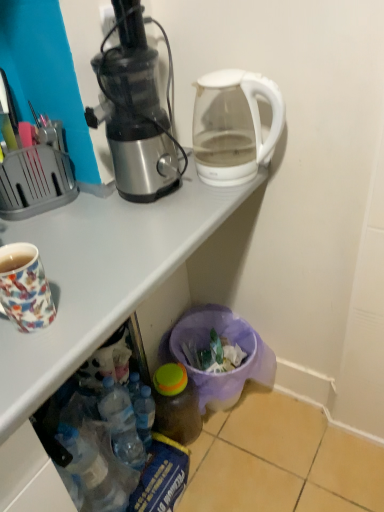
Identify the location of empty space that is ontop of white glossy desk at upper center. The image size is (384, 512). (100, 231).